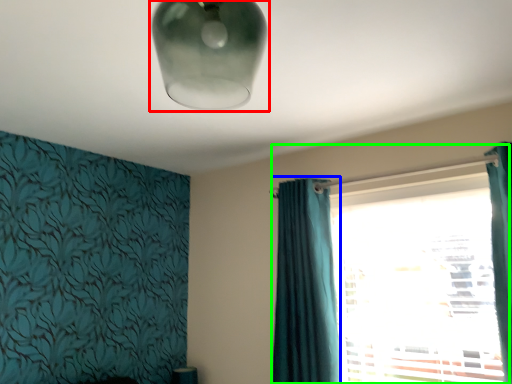
Question: Considering the real-world distances, which object is closest to lamp (highlighted by a red box)? curtain (highlighted by a blue box) or window (highlighted by a green box).

Choices:
 (A) curtain
 (B) window

Answer: (A)